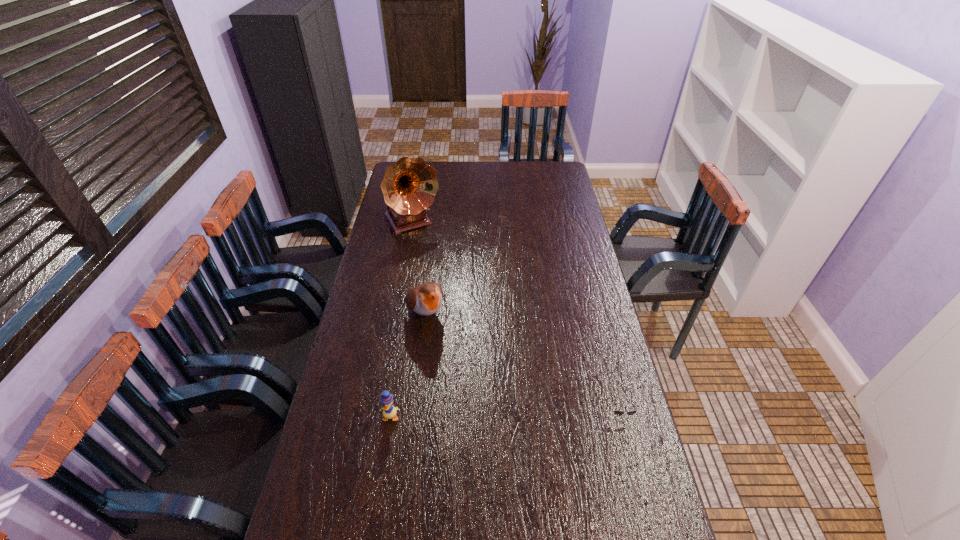
I want to click on duckling, so click(389, 411).

What are the coordinates of `sunglasses` in the screenshot? It's located at (617, 412).

The image size is (960, 540). I want to click on the rightmost object, so click(x=617, y=412).

This screenshot has width=960, height=540. I want to click on the second farthest object, so click(426, 299).

At what (x,y) coordinates should I click in order to perform the action: click on bird. Please return your answer as a coordinate pair (x, y). This screenshot has width=960, height=540. Looking at the image, I should click on (426, 299).

At what (x,y) coordinates should I click in order to perform the action: click on the tallest object. Please return your answer as a coordinate pair (x, y). This screenshot has width=960, height=540. Looking at the image, I should click on (409, 186).

Identify the location of the farthest object. (409, 186).

You are a GUI agent. You are given a task and a screenshot of the screen. Output one action in this format:
    pyautogui.click(x=<x>, y=<y>)
    Task: Click on the vacant area situated 0.280m on the face of the second shortest object, where the monocle is placed
    
    Given the screenshot: What is the action you would take?
    pyautogui.click(x=372, y=529)

Identify the location of vacant space located 0.230m in front of the lenses of the rightmost object. Image resolution: width=960 pixels, height=540 pixels. (643, 509).

This screenshot has width=960, height=540. In order to click on vacant point located at the face of the second farthest object in this screenshot , I will do pos(471,399).